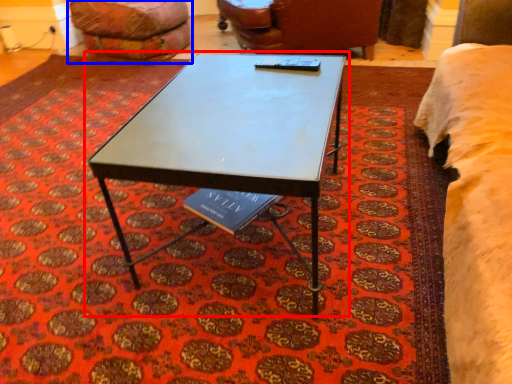
Question: Which point is further to the camera, coffee table (highlighted by a red box) or bean bag chair (highlighted by a blue box)?

Choices:
 (A) coffee table
 (B) bean bag chair

Answer: (B)